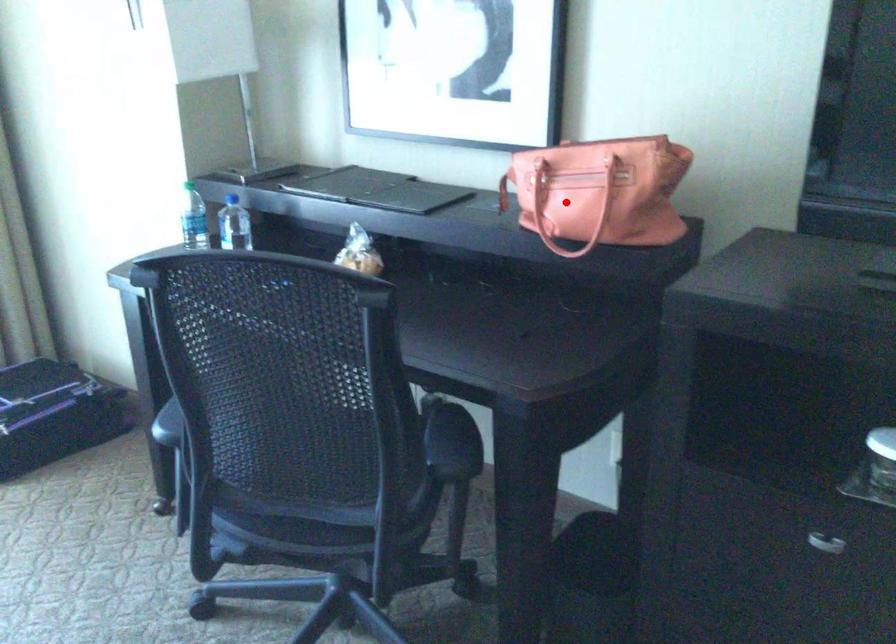
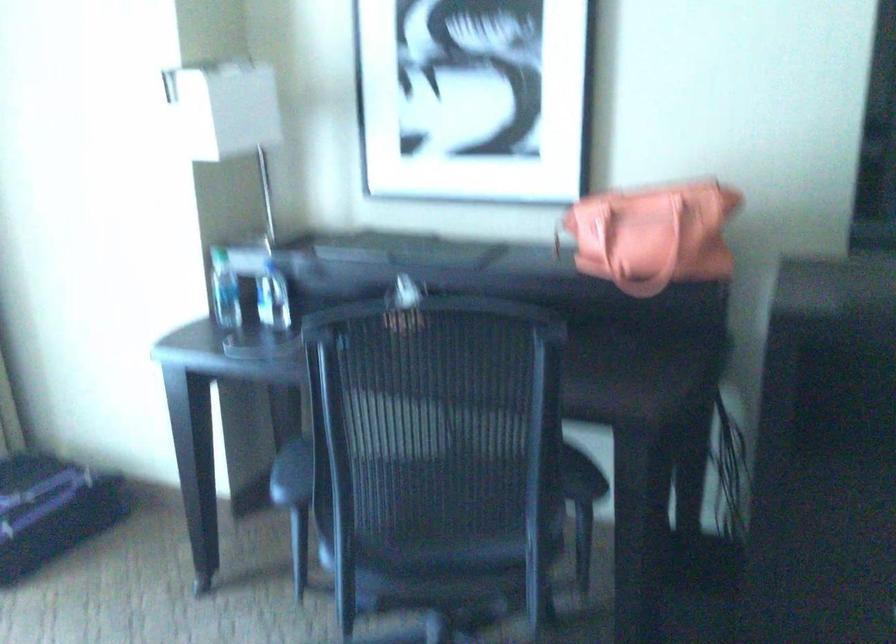
The point at the highlighted location is marked in the first image. Where is the corresponding point in the second image?

(633, 238)